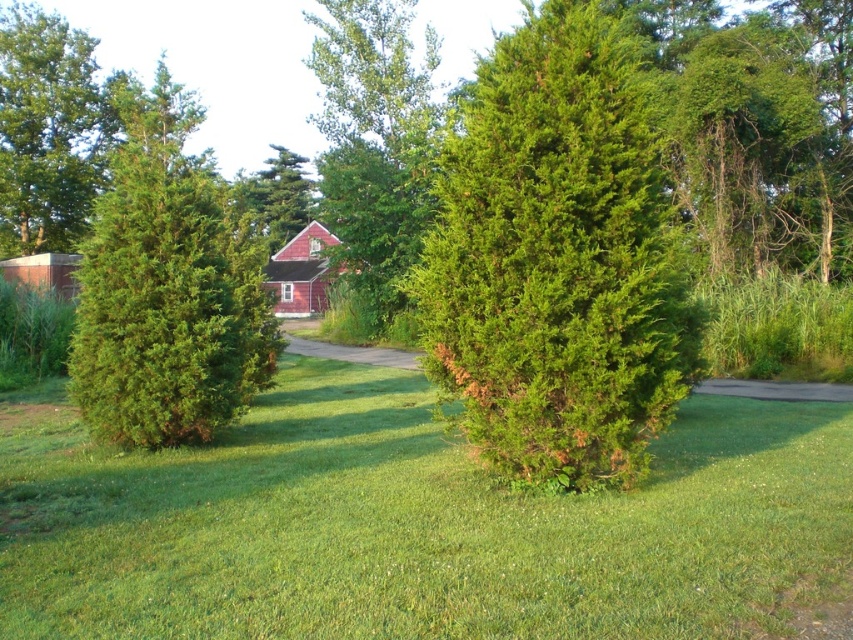
You are standing in the middle of the green grass at center and want to walk towards the green textured bush at left. Which direction should you face to move directly towards it?

You should face to the left because the green textured bush at left is to the left of the green grass at center.

You are planning to plant a new flower bed in the garden. You have two options for locations based on the image provided. The first option is near the green grass at center, and the second is near the green textured shrub at center. Which location has more available space for planting?

The green textured shrub at center has more available space since the green grass at center occupies less space than it.

You are standing in the middle of the lawn looking towards the red house. There are two points marked on the image. The first point is at coordinate (x=820, y=433) and the second is at (x=158, y=108). Which point is nearer to you?

Point (x=820, y=433) is closer to the camera than point (x=158, y=108), so the first point is nearer to you.